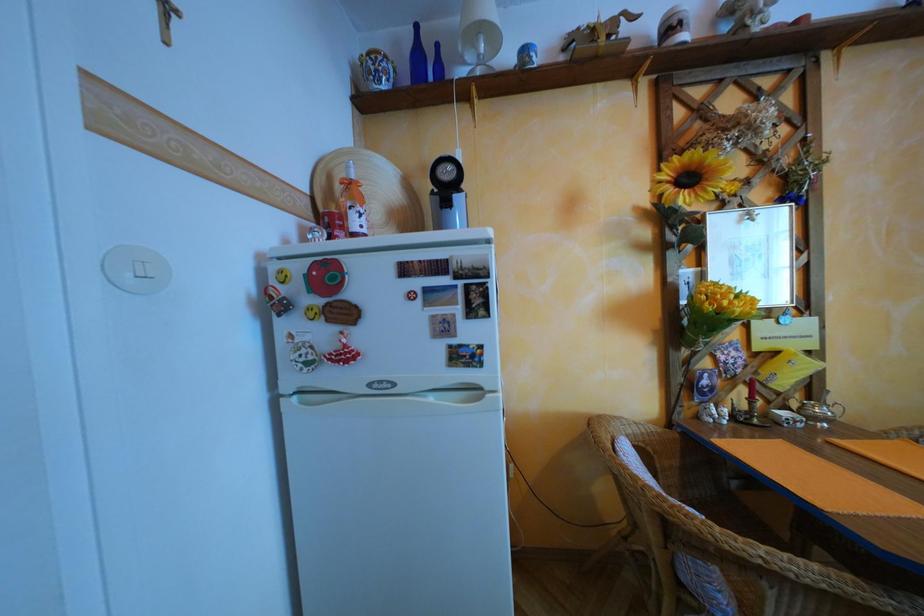
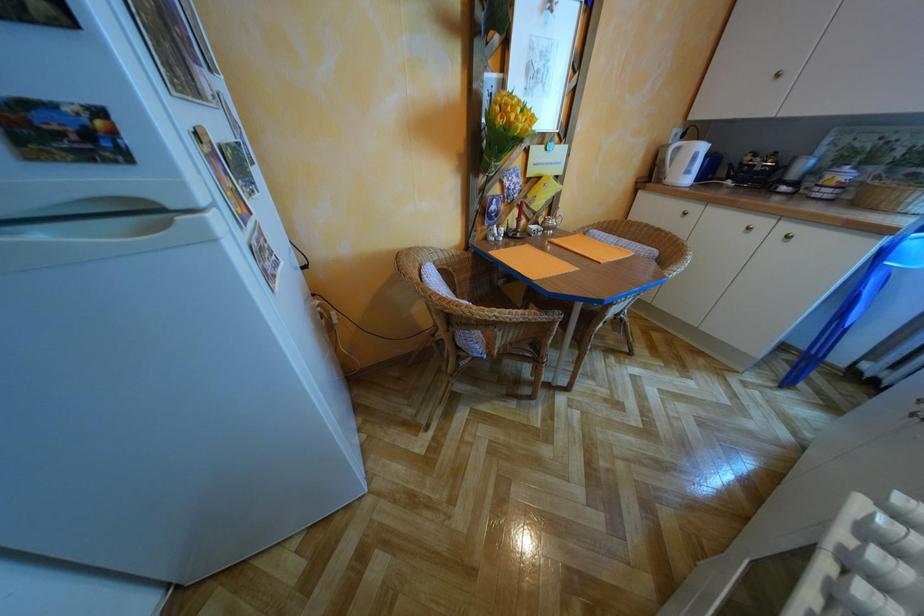
The images are taken continuously from a first-person perspective. In which direction is your viewpoint rotating?

The camera's rotation is toward right-down.